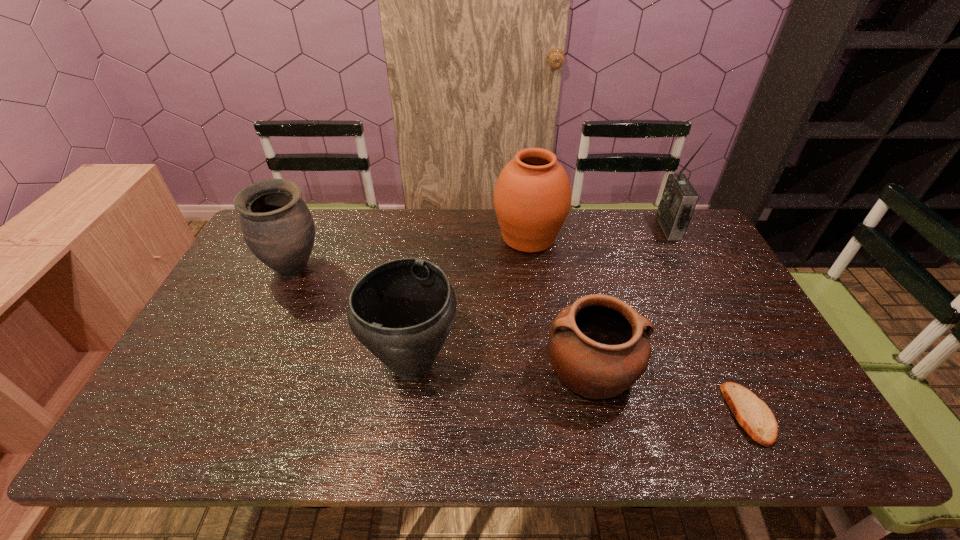
This screenshot has width=960, height=540. What are the coordinates of `empty space between the pita bread and the leftmost object` in the screenshot? It's located at (522, 341).

This screenshot has width=960, height=540. Identify the location of vacant region between the radio receiver and the leftmost urn. pyautogui.click(x=482, y=248).

The height and width of the screenshot is (540, 960). What are the coordinates of `vacant area that lies between the rightmost urn and the leftmost urn` in the screenshot? It's located at click(412, 253).

Find the location of a particular element. Image resolution: width=960 pixels, height=540 pixels. free space between the fifth object from right to left and the radio receiver is located at coordinates (540, 296).

This screenshot has width=960, height=540. I want to click on vacant area that lies between the rightmost urn and the radio receiver, so click(x=599, y=232).

Where is `vacant area that lies between the rightmost urn and the radio receiver`? Image resolution: width=960 pixels, height=540 pixels. vacant area that lies between the rightmost urn and the radio receiver is located at coordinates (599, 232).

I want to click on blank region between the leftmost urn and the radio receiver, so click(x=482, y=248).

Identify the location of object that is the second closest to the rightmost urn. This screenshot has width=960, height=540. (598, 346).

You are a GUI agent. You are given a task and a screenshot of the screen. Output one action in this format:
    pyautogui.click(x=<x>, y=<y>)
    Task: Click on the object that is the closest one to the radio receiver
    This screenshot has height=540, width=960.
    Given the screenshot: What is the action you would take?
    pyautogui.click(x=532, y=197)

Where is `the closest urn to the leftmost urn`? This screenshot has width=960, height=540. the closest urn to the leftmost urn is located at coordinates (402, 311).